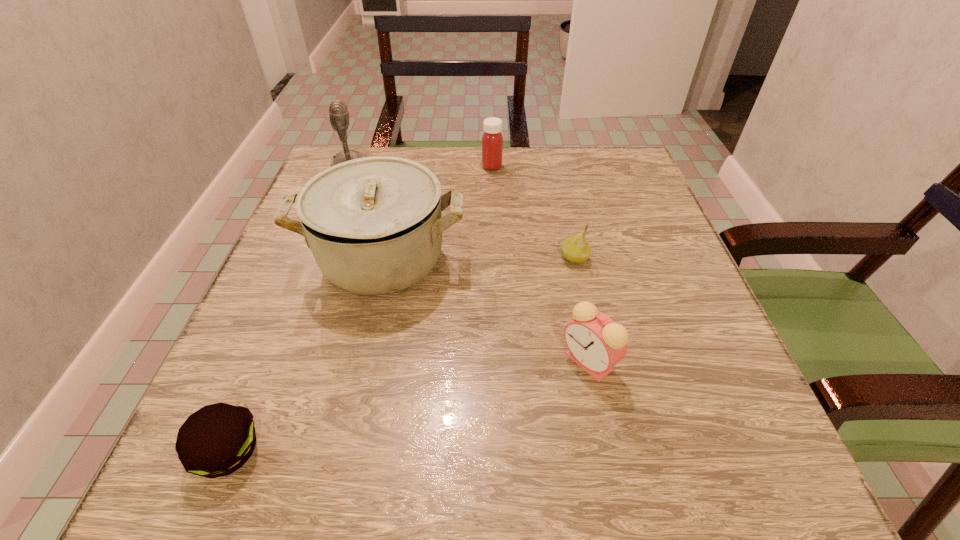
Locate an element on the screen. This screenshot has width=960, height=540. free space between the alarm clock and the saucepan is located at coordinates (486, 310).

Identify the location of vacant space that is in between the medicine and the nearest object. (360, 309).

Find the location of a particular element. The height and width of the screenshot is (540, 960). free spot between the pear and the saucepan is located at coordinates (478, 259).

Locate an element on the screen. object that stands as the second closest to the alarm clock is located at coordinates (374, 225).

Choose which object is the fifth nearest neighbor to the patty. Please provide its 2D coordinates. Your answer should be formatted as a tuple, i.e. [(x, y)], where the tuple contains the x and y coordinates of a point satisfying the conditions above.

[(492, 141)]

What are the coordinates of `free space that satisfies the following two spatial constraints: 1. on the front-facing side of the microphone; 2. on the right side of the fifth tallest object` in the screenshot? It's located at (314, 258).

You are a GUI agent. You are given a task and a screenshot of the screen. Output one action in this format:
    pyautogui.click(x=<x>, y=<y>)
    Task: Click on the free point that satisfies the following two spatial constraints: 1. on the back side of the saucepan; 2. on the right side of the fourth object from left to right
    This screenshot has height=540, width=960.
    Given the screenshot: What is the action you would take?
    pyautogui.click(x=404, y=166)

Where is `vacant area that satisfies the following two spatial constraints: 1. on the back side of the nearest object; 2. on the left side of the saucepan`? vacant area that satisfies the following two spatial constraints: 1. on the back side of the nearest object; 2. on the left side of the saucepan is located at coordinates tap(307, 259).